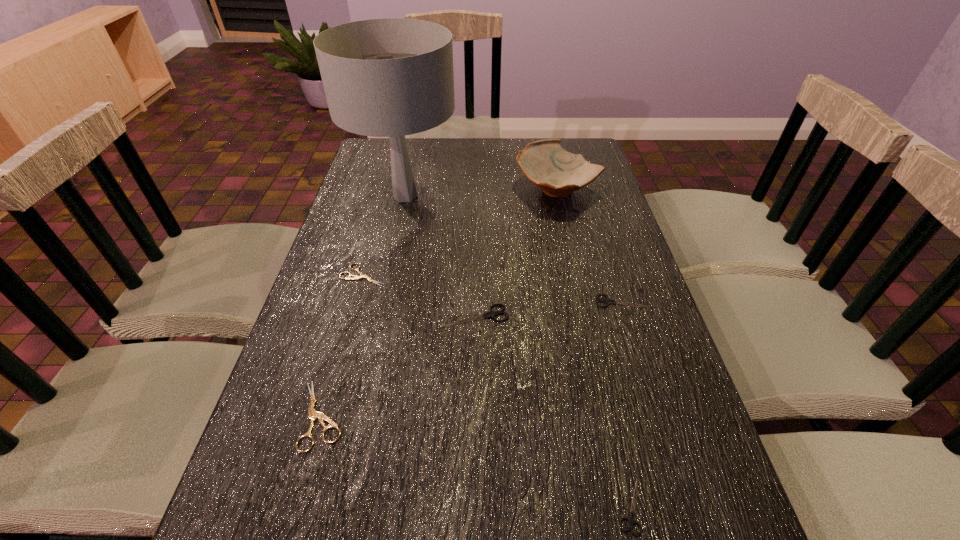
Locate an element on the screen. This screenshot has width=960, height=540. the farthest shears is located at coordinates (355, 277).

Find the location of `the nearest object`. the nearest object is located at coordinates pos(631,519).

You are a GUI agent. You are given a task and a screenshot of the screen. Output one action in this format:
    pyautogui.click(x=<x>, y=<y>)
    Task: Click on the smallest black shears
    The image size is (960, 540).
    Given the screenshot: What is the action you would take?
    pyautogui.click(x=631, y=519)

The image size is (960, 540). I want to click on free location located 0.300m on the front-facing side of the brown lampshade, so click(554, 196).

Find the location of a particular element. free region located on the left of the pottery is located at coordinates (496, 190).

This screenshot has height=540, width=960. Find the location of `vacant space situated 0.120m on the right of the third tallest object`. vacant space situated 0.120m on the right of the third tallest object is located at coordinates (561, 315).

The height and width of the screenshot is (540, 960). Identify the location of vacant space situated on the front of the rightmost black shears. (638, 356).

The width and height of the screenshot is (960, 540). Identify the location of free region located on the front of the nearer beige shears. (300, 494).

The width and height of the screenshot is (960, 540). I want to click on free location located 0.080m on the front of the farthest shears, so click(x=353, y=311).

This screenshot has width=960, height=540. In order to click on vacant space situated 0.130m on the back of the nearest shears in this screenshot , I will do `click(609, 410)`.